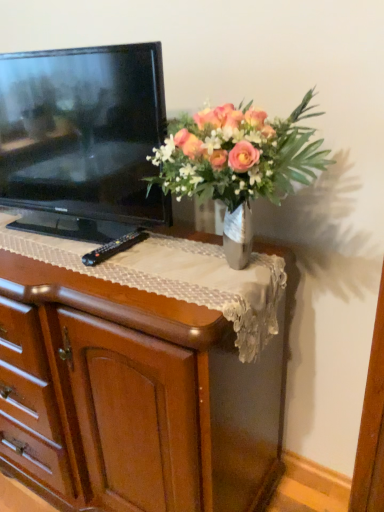
Identify the location of free space in front of black plastic remote at center. (112, 275).